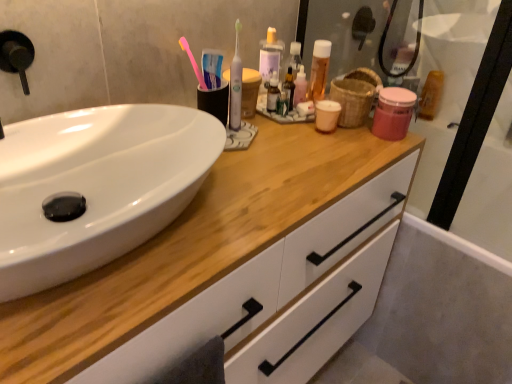
Question: Is white glossy sink at left further to camera compared to bamboo basket at upper right?

Choices:
 (A) no
 (B) yes

Answer: (A)

Question: From a real-world perspective, does white glossy sink at left sit lower than bamboo basket at upper right?

Choices:
 (A) yes
 (B) no

Answer: (A)

Question: From the image's perspective, would you say white glossy sink at left is shown under bamboo basket at upper right?

Choices:
 (A) yes
 (B) no

Answer: (A)

Question: Can you confirm if white glossy sink at left is positioned to the left of bamboo basket at upper right?

Choices:
 (A) no
 (B) yes

Answer: (B)

Question: Is the surface of white glossy sink at left in direct contact with bamboo basket at upper right?

Choices:
 (A) yes
 (B) no

Answer: (B)

Question: From a real-world perspective, relative to white glossy sink at left, is pink plastic toothbrush at upper center, which is the 2th toothbrush from right to left, vertically above or below?

Choices:
 (A) below
 (B) above

Answer: (B)

Question: Would you say pink plastic toothbrush at upper center, the 1th toothbrush in the left-to-right sequence, is inside or outside white glossy sink at left?

Choices:
 (A) inside
 (B) outside

Answer: (B)

Question: Is pink plastic toothbrush at upper center, the 1th toothbrush in the left-to-right sequence, to the left or to the right of white glossy sink at left in the image?

Choices:
 (A) right
 (B) left

Answer: (A)

Question: Relative to white glossy sink at left, is pink plastic toothbrush at upper center, which is the 2th toothbrush from right to left, in front or behind?

Choices:
 (A) front
 (B) behind

Answer: (B)

Question: In the image, is bamboo basket at upper right on the left side or the right side of pink plastic toothbrush at upper center, which is the 2th toothbrush from right to left?

Choices:
 (A) left
 (B) right

Answer: (B)

Question: Choose the correct answer: Is bamboo basket at upper right inside pink plastic toothbrush at upper center, which is the 2th toothbrush from right to left, or outside it?

Choices:
 (A) inside
 (B) outside

Answer: (B)

Question: Is bamboo basket at upper right bigger or smaller than pink plastic toothbrush at upper center, the 1th toothbrush in the left-to-right sequence?

Choices:
 (A) big
 (B) small

Answer: (A)

Question: From a real-world perspective, is bamboo basket at upper right positioned above or below pink plastic toothbrush at upper center, which is the 2th toothbrush from right to left?

Choices:
 (A) above
 (B) below

Answer: (B)

Question: From a real-world perspective, is white glossy toothbrush at center, acting as the 2th toothbrush starting from the left, positioned above or below bamboo basket at upper right?

Choices:
 (A) below
 (B) above

Answer: (B)

Question: Is white glossy toothbrush at center, acting as the 2th toothbrush starting from the left, bigger or smaller than bamboo basket at upper right?

Choices:
 (A) small
 (B) big

Answer: (A)